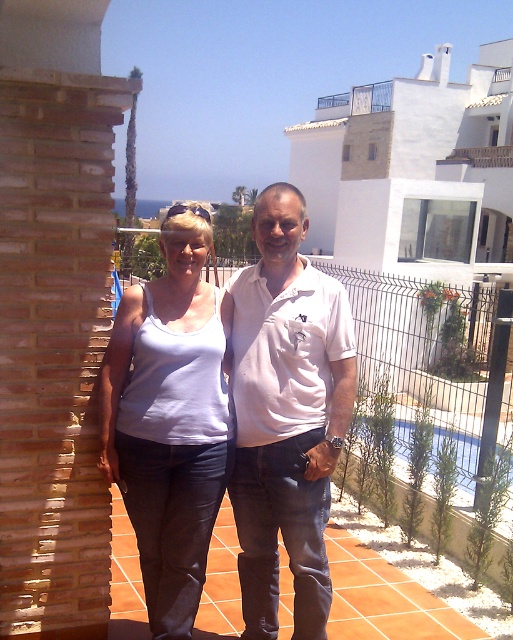
You are standing on the tiled patio and want to walk from point (x=162, y=365) to point (x=480, y=152). Which direction should you face to move towards the point that is farther away from you?

You should face towards the direction of point (x=480, y=152) because it is farther away from you compared to point (x=162, y=365).

From the picture: You are a fashion designer observing the two white tops worn by the people in the image. Which one is taller between the white cotton polo shirt at center and the white matte tank top at center?

The white cotton polo shirt at center has a greater height compared to the white matte tank top at center, so the white cotton polo shirt at center is taller.

You are a photographer setting up a camera on the patio. You want to ensure both the white cotton polo shirt at center and the white painted wood at upper right are clearly visible in your shot. Given their heights, which object will appear larger in the photo?

The white cotton polo shirt at center will appear larger in the photo since it has a greater height compared to the white painted wood at upper right.